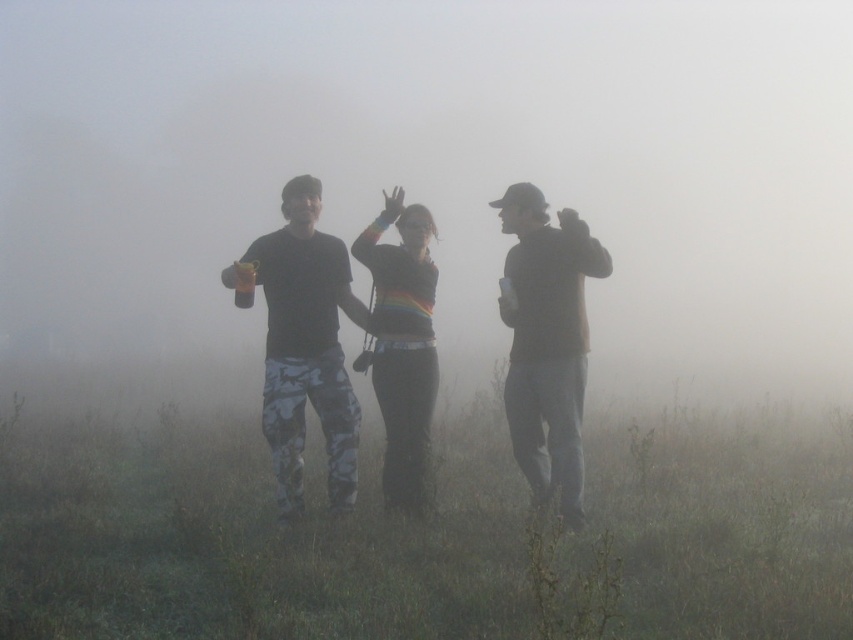
You are a photographer trying to capture a clear shot of the camouflage pants at center and the matte brown sweater at right. Given the foggy conditions, which of the two objects would appear more clearly in your photo?

The camouflage pants at center would appear more clearly in the photo because it is much taller than the matte brown sweater at right, making it less obscured by the fog.

You are a photographer trying to capture a group photo of the camouflage pants at center and the matte brown sweater at right. If your camera has a maximum focus range of 4 feet, will you be able to get both subjects in focus at the same time?

The distance between the camouflage pants at center and the matte brown sweater at right is 4.15 feet, which exceeds the camera maximum focus range of 4 feet. Therefore, both subjects cannot be in focus simultaneously.